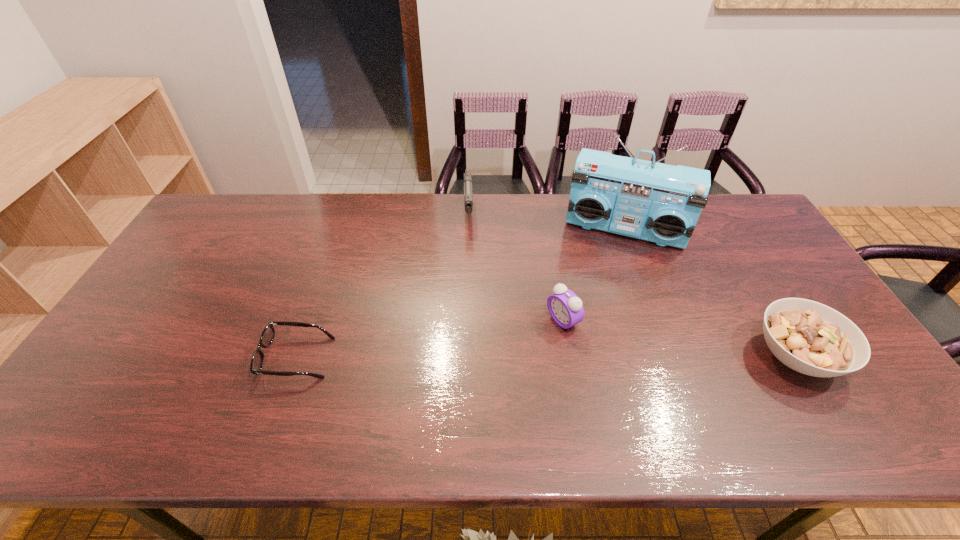
Locate an element on the screen. blank area located in the direction the gun is aimed is located at coordinates (469, 261).

The height and width of the screenshot is (540, 960). Find the location of `vacant space located 0.320m in the direction the gun is aimed`. vacant space located 0.320m in the direction the gun is aimed is located at coordinates (470, 301).

What are the coordinates of `vacant region located in the direction the gun is aimed` in the screenshot? It's located at (470, 291).

The image size is (960, 540). Find the location of `vacant space located on the front-facing side of the radio receiver`. vacant space located on the front-facing side of the radio receiver is located at coordinates pos(588,342).

Where is `free space located on the front-facing side of the radio receiver`? free space located on the front-facing side of the radio receiver is located at coordinates (600, 298).

Where is `vacant point located 0.110m on the front-facing side of the radio receiver`? Image resolution: width=960 pixels, height=540 pixels. vacant point located 0.110m on the front-facing side of the radio receiver is located at coordinates (605, 276).

This screenshot has width=960, height=540. I want to click on free location located 0.120m on the face of the alarm clock, so click(x=515, y=349).

Identify the location of blank space located 0.070m on the face of the alarm clock. (530, 340).

Locate an element on the screen. blank space located on the face of the alarm clock is located at coordinates (517, 347).

This screenshot has height=540, width=960. In order to click on gun present at the far edge in this screenshot , I will do `click(468, 198)`.